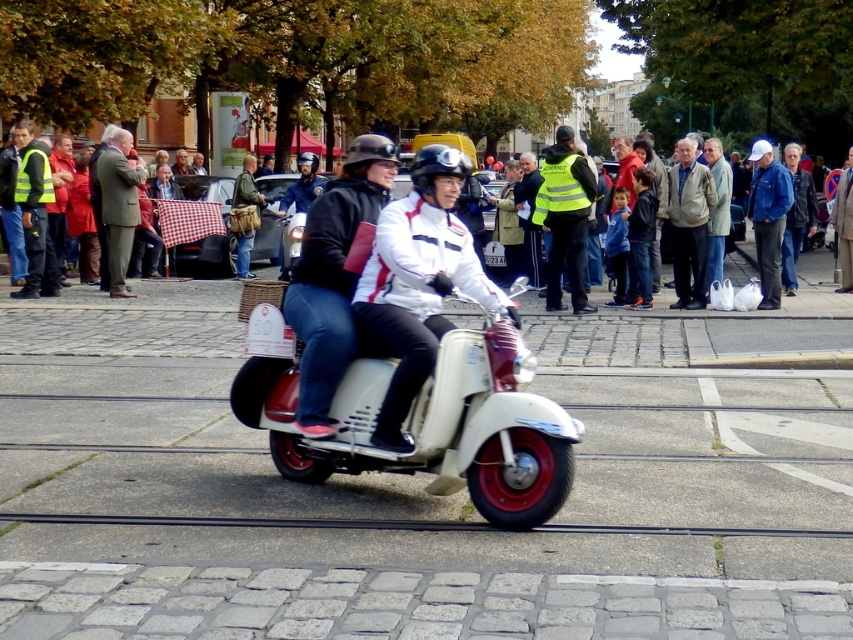
Is matte black helmet at center wider than green wool coat at center?

In fact, matte black helmet at center might be narrower than green wool coat at center.

Between matte black helmet at center and green wool coat at center, which one has less height?

matte black helmet at center

Between point (346, 236) and point (97, 179), which one is positioned behind?

Point (97, 179)

You are a GUI agent. You are given a task and a screenshot of the screen. Output one action in this format:
    pyautogui.click(x=<x>, y=<y>)
    Task: Click on the matte black helmet at center
    Image resolution: width=853 pixels, height=640 pixels.
    Given the screenshot: What is the action you would take?
    pyautogui.click(x=334, y=275)

Who is positioned more to the left, yellow reflective vest at left or yellow reflective vest at center?

yellow reflective vest at left is more to the left.

Which of these two, yellow reflective vest at left or yellow reflective vest at center, stands shorter?

Standing shorter between the two is yellow reflective vest at center.

Identify the location of yellow reflective vest at left. (33, 214).

Can you confirm if white matte jacket at center is shorter than high-visibility yellow jacket at center?

In fact, white matte jacket at center may be taller than high-visibility yellow jacket at center.

Image resolution: width=853 pixels, height=640 pixels. In order to click on white matte jacket at center in this screenshot , I will do [x=418, y=282].

The height and width of the screenshot is (640, 853). Find the location of `white matte jacket at center`. white matte jacket at center is located at coordinates (418, 282).